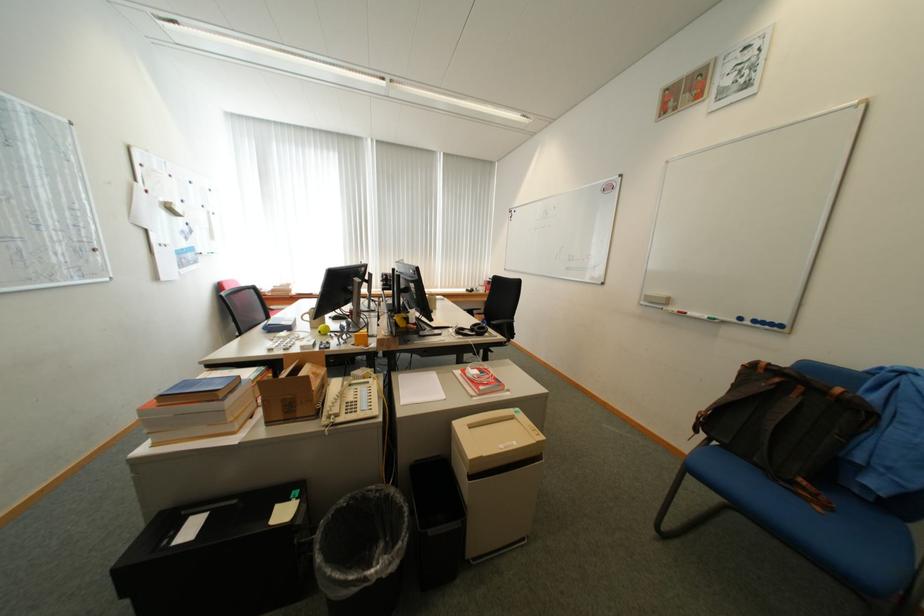
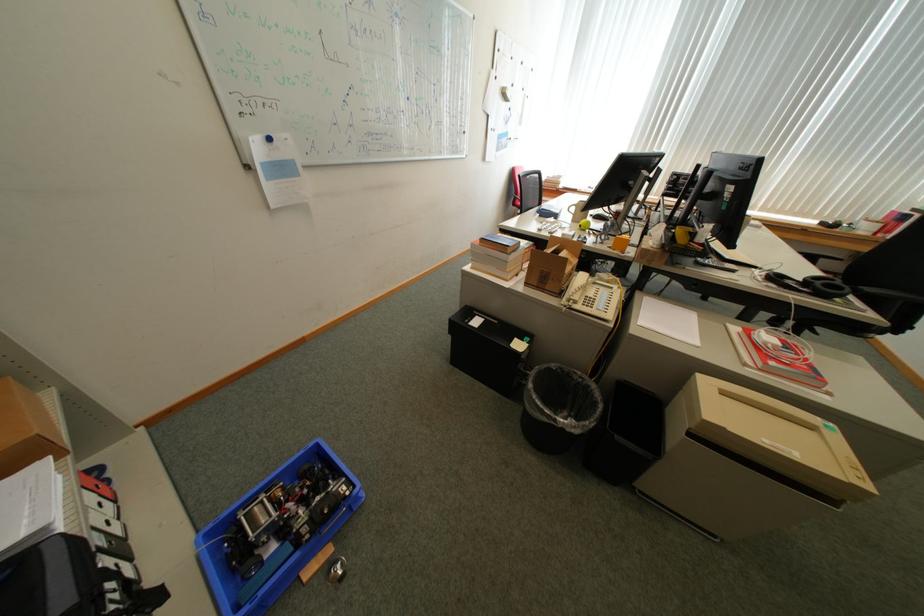
In the second image, find the point that corresponds to (322,329) in the first image.

(582, 223)